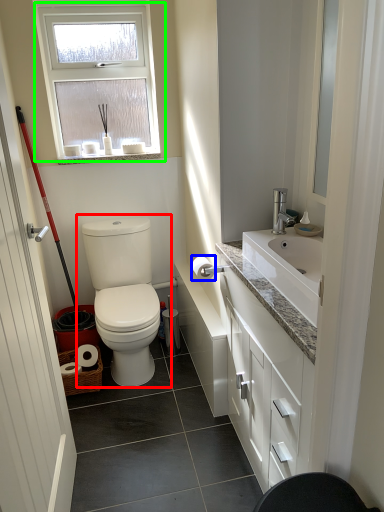
Question: Considering the real-world distances, which object is closest to toilet (highlighted by a red box)? toilet paper (highlighted by a blue box) or window (highlighted by a green box).

Choices:
 (A) toilet paper
 (B) window

Answer: (A)